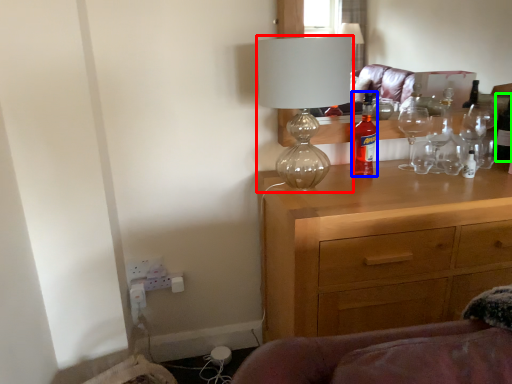
Question: Which is nearer to the lamp (highlighted by a red box)? bottle (highlighted by a blue box) or bottle (highlighted by a green box).

Choices:
 (A) bottle
 (B) bottle

Answer: (A)